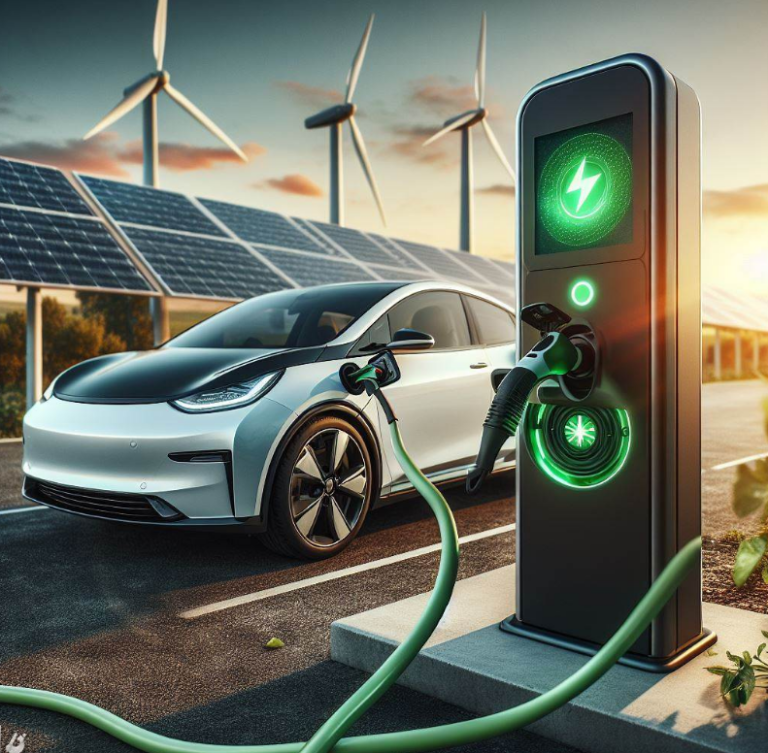
Identify the location of charger stand. This screenshot has height=753, width=768. (578, 505).